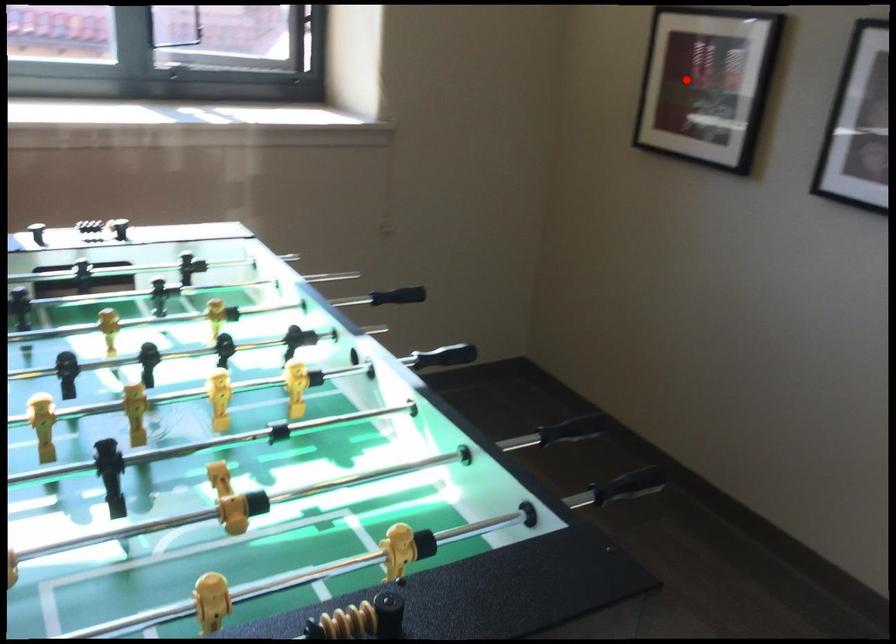
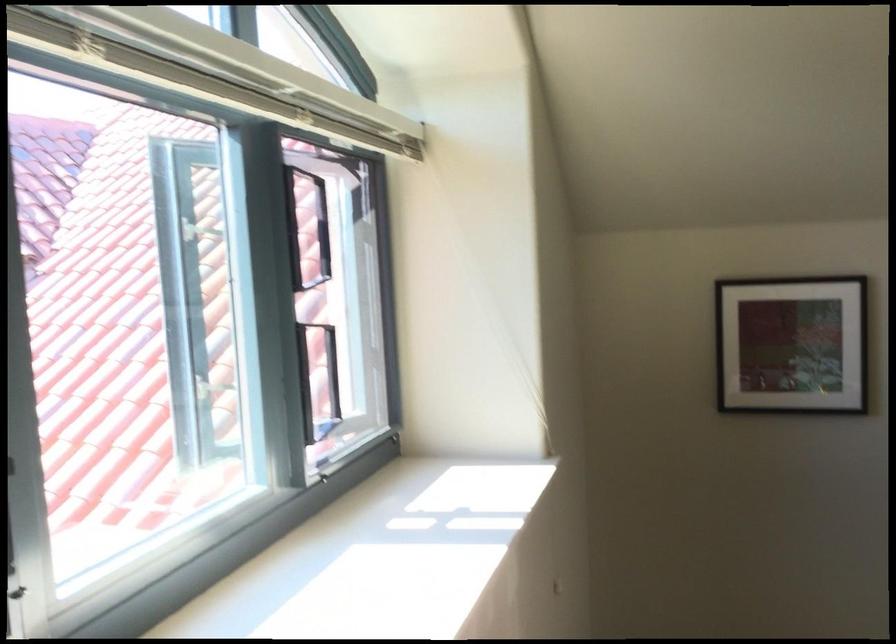
Where in the second image is the point corresponding to the highlighted location from the first image?

(791, 345)